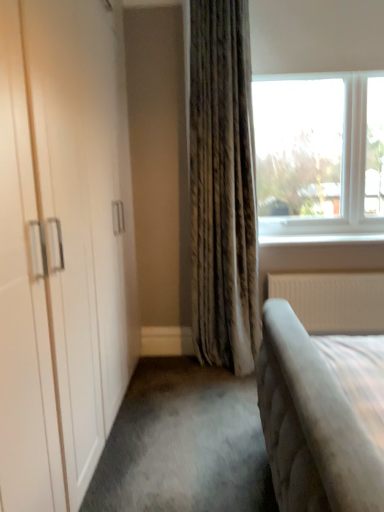
Question: From a real-world perspective, is white textured radiator at lower right positioned above or below white glossy window sill at upper right?

Choices:
 (A) below
 (B) above

Answer: (A)

Question: From the image's perspective, is white textured radiator at lower right positioned above or below white glossy window sill at upper right?

Choices:
 (A) below
 (B) above

Answer: (A)

Question: Which object is positioned farthest from the white glossy window sill at upper right?

Choices:
 (A) clear glass window at upper right
 (B) white textured radiator at lower right

Answer: (A)

Question: Based on their relative distances, which object is nearer to the clear glass window at upper right?

Choices:
 (A) white textured radiator at lower right
 (B) white glossy window sill at upper right

Answer: (B)